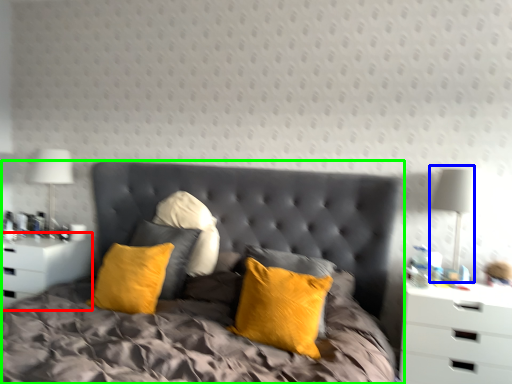
Question: Considering the real-world distances, which object is closest to nightstand (highlighted by a red box)? bedside lamp (highlighted by a blue box) or bed (highlighted by a green box).

Choices:
 (A) bedside lamp
 (B) bed

Answer: (B)